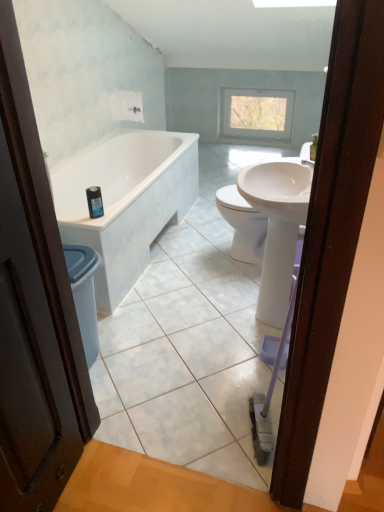
Question: From the image's perspective, is white glossy bathtub at left over clear glass window at upper center?

Choices:
 (A) no
 (B) yes

Answer: (A)

Question: Considering the relative sizes of white glossy bathtub at left and clear glass window at upper center in the image provided, is white glossy bathtub at left taller than clear glass window at upper center?

Choices:
 (A) no
 (B) yes

Answer: (A)

Question: Is the position of white glossy bathtub at left more distant than that of clear glass window at upper center?

Choices:
 (A) yes
 (B) no

Answer: (B)

Question: Considering the relative sizes of white glossy bathtub at left and clear glass window at upper center in the image provided, is white glossy bathtub at left bigger than clear glass window at upper center?

Choices:
 (A) yes
 (B) no

Answer: (A)

Question: Is white glossy bathtub at left closer to camera compared to clear glass window at upper center?

Choices:
 (A) yes
 (B) no

Answer: (A)

Question: Considering the positions of clear glass window at upper center and white glossy bathtub at left in the image, is clear glass window at upper center bigger or smaller than white glossy bathtub at left?

Choices:
 (A) big
 (B) small

Answer: (B)

Question: Does point (283, 95) appear closer or farther from the camera than point (117, 216)?

Choices:
 (A) farther
 (B) closer

Answer: (A)

Question: In terms of height, does clear glass window at upper center look taller or shorter compared to white glossy bathtub at left?

Choices:
 (A) tall
 (B) short

Answer: (A)

Question: From a real-world perspective, relative to white glossy bathtub at left, is clear glass window at upper center vertically above or below?

Choices:
 (A) above
 (B) below

Answer: (A)

Question: Considering their positions, is clear glass window at upper center located in front of or behind white glossy sink at center?

Choices:
 (A) front
 (B) behind

Answer: (B)

Question: Would you say clear glass window at upper center is inside or outside white glossy sink at center?

Choices:
 (A) inside
 (B) outside

Answer: (B)

Question: In the image, is clear glass window at upper center on the left side or the right side of white glossy sink at center?

Choices:
 (A) right
 (B) left

Answer: (A)

Question: Is clear glass window at upper center taller or shorter than white glossy sink at center?

Choices:
 (A) tall
 (B) short

Answer: (B)

Question: Based on their positions, is blue glossy bottle at upper left located to the left or right of white glossy sink at center?

Choices:
 (A) left
 (B) right

Answer: (A)

Question: Which is correct: blue glossy bottle at upper left is inside white glossy sink at center, or outside of it?

Choices:
 (A) outside
 (B) inside

Answer: (A)